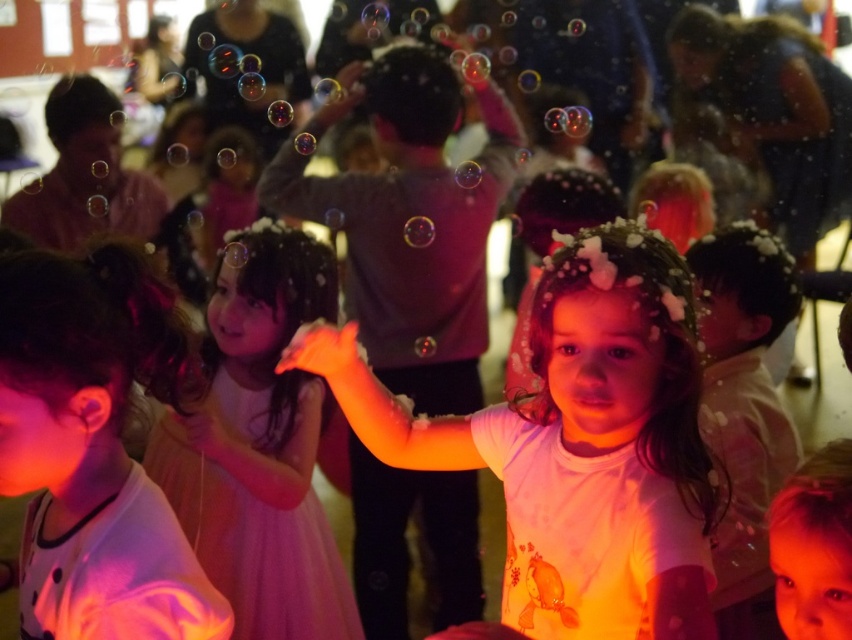
Who is more distant from viewer, (492, 179) or (741, 504)?

Point (492, 179)

Who is positioned more to the right, matte white shirt at center or smooth cream shirt at center?

smooth cream shirt at center is more to the right.

Who is more forward, (409, 128) or (798, 291)?

Point (798, 291) is more forward.

This screenshot has width=852, height=640. In order to click on matte white shirt at center in this screenshot , I will do `click(407, 218)`.

Who is more distant from viewer, (429,120) or (164,308)?

Point (429,120)

Is matte white shirt at center above matte white dress at center?

Correct, matte white shirt at center is located above matte white dress at center.

The image size is (852, 640). What are the coordinates of `matte white shirt at center` in the screenshot? It's located at (407, 218).

Where is `smooth cream shirt at center`? smooth cream shirt at center is located at coordinates click(744, 410).

Can you confirm if smooth cream shirt at center is wider than smooth skin face at center?

Indeed, smooth cream shirt at center has a greater width compared to smooth skin face at center.

Image resolution: width=852 pixels, height=640 pixels. I want to click on smooth cream shirt at center, so click(x=744, y=410).